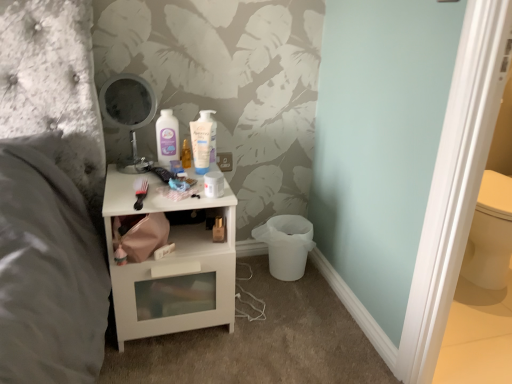
Question: Does metallic round mirror at upper center come in front of white glossy mouthwash at center, which ranks as the 2th mouthwash in left-to-right order?

Choices:
 (A) no
 (B) yes

Answer: (B)

Question: Is metallic round mirror at upper center positioned with its back to white glossy mouthwash at center, which ranks as the 2th mouthwash in left-to-right order?

Choices:
 (A) no
 (B) yes

Answer: (A)

Question: Does metallic round mirror at upper center touch white glossy mouthwash at center, which ranks as the 2th mouthwash in left-to-right order?

Choices:
 (A) no
 (B) yes

Answer: (A)

Question: Is metallic round mirror at upper center at the right side of white glossy mouthwash at center, which is the first mouthwash from right to left?

Choices:
 (A) yes
 (B) no

Answer: (B)

Question: Is white glossy mouthwash at center, which is the first mouthwash from right to left, located within metallic round mirror at upper center?

Choices:
 (A) no
 (B) yes

Answer: (A)

Question: From a real-world perspective, does metallic round mirror at upper center stand above white glossy mouthwash at center, which ranks as the 2th mouthwash in left-to-right order?

Choices:
 (A) no
 (B) yes

Answer: (B)

Question: Is matte plastic mouthwash at center, the 1th mouthwash from the left, turned away from metallic round mirror at upper center?

Choices:
 (A) yes
 (B) no

Answer: (B)

Question: Are matte plastic mouthwash at center, the 1th mouthwash from the left, and metallic round mirror at upper center making contact?

Choices:
 (A) no
 (B) yes

Answer: (A)

Question: Considering the relative positions of matte plastic mouthwash at center, the 1th mouthwash from the left, and metallic round mirror at upper center in the image provided, is matte plastic mouthwash at center, the 1th mouthwash from the left, behind metallic round mirror at upper center?

Choices:
 (A) yes
 (B) no

Answer: (A)

Question: Is matte plastic mouthwash at center, the 1th mouthwash from the left, in front of metallic round mirror at upper center?

Choices:
 (A) no
 (B) yes

Answer: (A)

Question: Is matte plastic mouthwash at center, the 1th mouthwash from the left, aimed at metallic round mirror at upper center?

Choices:
 (A) no
 (B) yes

Answer: (A)

Question: Is matte plastic mouthwash at center, positioned as the 2th mouthwash in right-to-left order, smaller than metallic round mirror at upper center?

Choices:
 (A) no
 (B) yes

Answer: (B)

Question: Is metallic round mirror at upper center a part of white glossy nightstand at center?

Choices:
 (A) yes
 (B) no

Answer: (B)